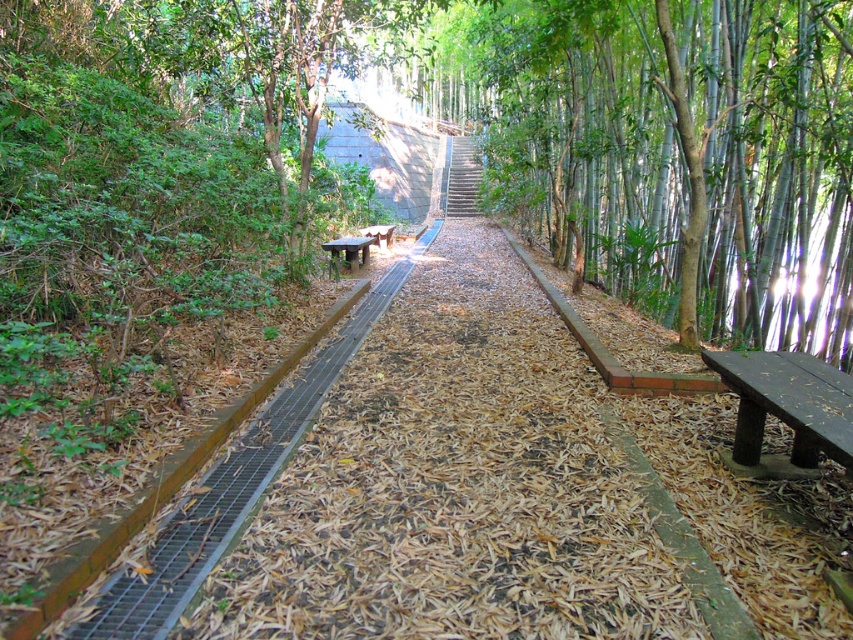
Is dark brown wooden bench at right shorter than brown wooden bench at center?

Correct, dark brown wooden bench at right is not as tall as brown wooden bench at center.

Measure the distance between dark brown wooden bench at right and brown wooden bench at center.

4.53 meters

Where is `dark brown wooden bench at right`? Image resolution: width=853 pixels, height=640 pixels. dark brown wooden bench at right is located at coordinates (787, 403).

Between point (473, 150) and point (351, 248), which one is positioned in front?

Point (351, 248)

Looking at this image, who is lower down, smooth concrete stairs at center or brown wooden bench at center?

Positioned lower is brown wooden bench at center.

Is point (474, 173) less distant than point (366, 246)?

No, (474, 173) is behind (366, 246).

This screenshot has width=853, height=640. What are the coordinates of `smooth concrete stairs at center` in the screenshot? It's located at (463, 177).

Can you confirm if smooth concrete stairs at center is thinner than wooden bench at center?

No.

Describe the element at coordinates (463, 177) in the screenshot. I see `smooth concrete stairs at center` at that location.

Is point (479, 154) farther from camera compared to point (389, 236)?

Yes, it is.

The image size is (853, 640). In order to click on smooth concrete stairs at center in this screenshot , I will do coord(463,177).